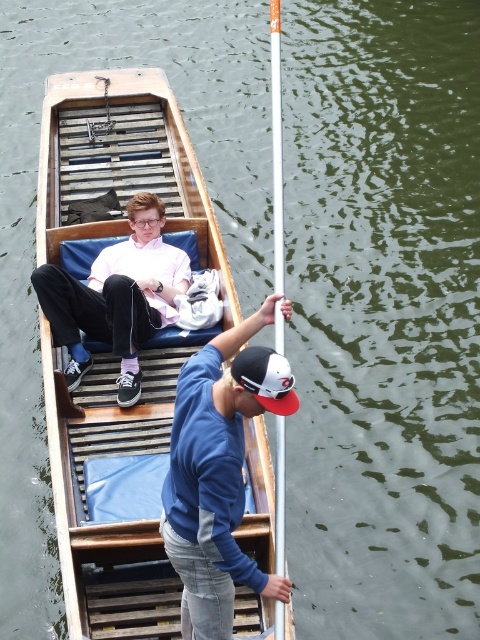
Question: Which point appears closest to the camera in this image?

Choices:
 (A) (264, 380)
 (B) (95, 260)
 (C) (286, 589)
 (D) (276, 339)

Answer: (A)

Question: Which object is farther from the camera taking this photo?

Choices:
 (A) silver metallic pole at center
 (B) wooden boat at center

Answer: (B)

Question: Which point is farther to the camera?

Choices:
 (A) blue cotton shirt at center
 (B) white matte baseball cap at center

Answer: (B)

Question: Is matte pink shirt at center thinner than white matte baseball cap at center?

Choices:
 (A) yes
 (B) no

Answer: (B)

Question: In this image, where is matte pink shirt at center located relative to white matte baseball cap at center?

Choices:
 (A) above
 (B) below

Answer: (A)

Question: Can you confirm if wooden boat at center is positioned to the left of silver metallic pole at center?

Choices:
 (A) no
 (B) yes

Answer: (B)